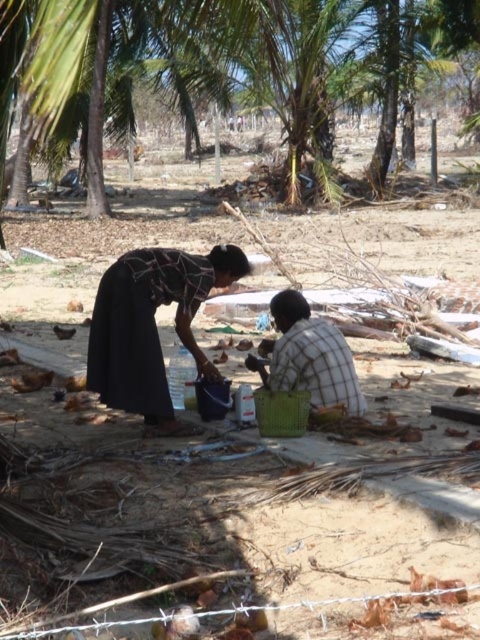
Which is more to the right, dark fabric skirt at center or checkered fabric shirt at center?

From the viewer's perspective, checkered fabric shirt at center appears more on the right side.

What do you see at coordinates (152, 326) in the screenshot? I see `dark fabric skirt at center` at bounding box center [152, 326].

The image size is (480, 640). I want to click on dark fabric skirt at center, so click(152, 326).